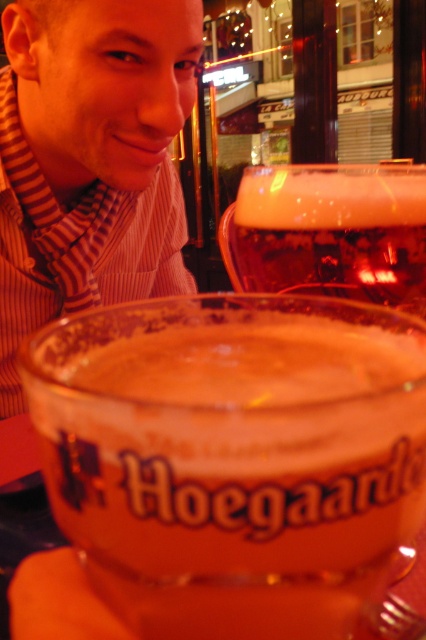
Does translucent glass hoegaarden beer at center lie in front of foamy amber glass at center?

Yes, translucent glass hoegaarden beer at center is closer to the viewer.

Based on the photo, between translucent glass hoegaarden beer at center and foamy amber glass at center, which one has more height?

Standing taller between the two is foamy amber glass at center.

Which is in front, point (374, 524) or point (400, 220)?

Positioned in front is point (374, 524).

Where is `translucent glass hoegaarden beer at center`? This screenshot has height=640, width=426. translucent glass hoegaarden beer at center is located at coordinates (233, 458).

At what (x,y) coordinates should I click in order to perform the action: click on translucent glass hoegaarden beer at center. Please return your answer as a coordinate pair (x, y). Looking at the image, I should click on coord(233,458).

Can you confirm if translucent glass hoegaarden beer at center is smaller than matte striped scarf at upper left?

Yes.

Who is more distant from viewer, (327, 420) or (112, 58)?

The point (112, 58) is more distant.

What are the coordinates of `translucent glass hoegaarden beer at center` in the screenshot? It's located at (233, 458).

Does matte striped scarf at upper left appear on the left side of foamy amber glass at center?

Indeed, matte striped scarf at upper left is positioned on the left side of foamy amber glass at center.

Can you confirm if matte striped scarf at upper left is positioned above foamy amber glass at center?

Indeed, matte striped scarf at upper left is positioned over foamy amber glass at center.

The width and height of the screenshot is (426, 640). I want to click on matte striped scarf at upper left, so click(91, 160).

You are a GUI agent. You are given a task and a screenshot of the screen. Output one action in this format:
    pyautogui.click(x=<x>, y=<y>)
    Task: Click on the matte striped scarf at upper left
    
    Given the screenshot: What is the action you would take?
    pyautogui.click(x=91, y=160)